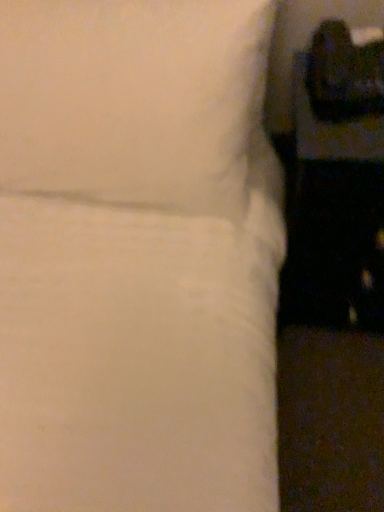
Locate an element on the screen. Image resolution: width=384 pixels, height=512 pixels. white soft pillow at upper right is located at coordinates (133, 100).

The width and height of the screenshot is (384, 512). What do you see at coordinates (133, 100) in the screenshot?
I see `white soft pillow at upper right` at bounding box center [133, 100].

What is the approximate height of white soft pillow at upper right?

white soft pillow at upper right is 45.03 centimeters tall.

Image resolution: width=384 pixels, height=512 pixels. I want to click on white soft pillow at upper right, so click(x=133, y=100).